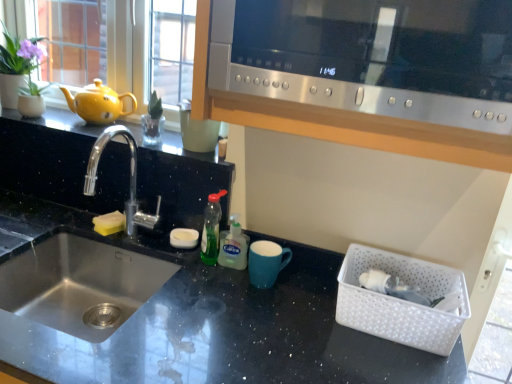
This screenshot has width=512, height=384. I want to click on vacant region in front of matte blue mug at center, so click(280, 317).